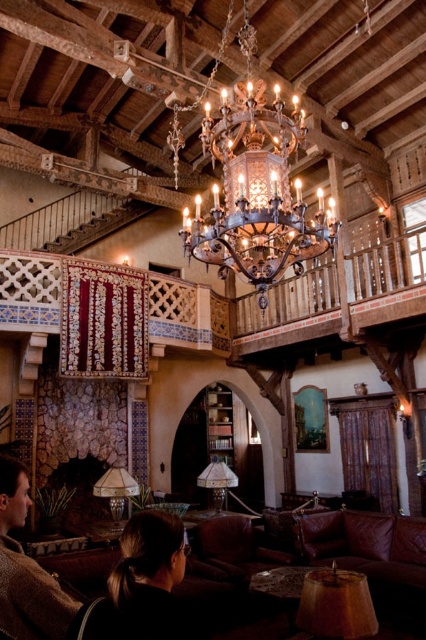
You are a decorator planning to hang a new artwork in this grand living room. You have the antique brass chandelier at center and the brown wool sweater at lower left in your design plan. Which object is wider?

The antique brass chandelier at center is wider than the brown wool sweater at lower left according to the description.

You are a guest standing in the center of the room. You want to move to the antique brass chandelier at center to adjust its light. However, there is a dark brown leather hair at center in your path. Can you reach the chandelier without moving the hair?

The antique brass chandelier at center is 2.84 meters away from the dark brown leather hair at center. Since the distance between them is quite large, you can easily reach the chandelier without disturbing the hair.

Based on the photo, you are a guest in this grand living room and notice the antique brass chandelier at center and the brown wool sweater at lower left. Which object is positioned higher in the room?

The antique brass chandelier at center is positioned higher than the brown wool sweater at lower left because it is located above it.